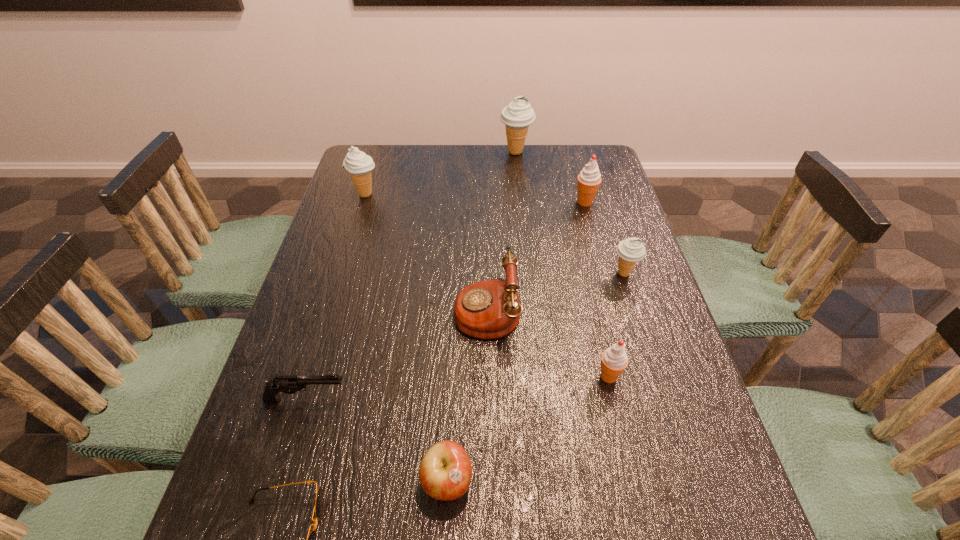
Locate an element on the screen. This screenshot has height=540, width=960. free space that satisfies the following two spatial constraints: 1. at the end of the barrel of the gun; 2. on the back side of the apple is located at coordinates (282, 481).

Identify the location of vacant space that satisfies the following two spatial constraints: 1. on the front side of the nearer red icecream; 2. at the end of the barrel of the third nearest object. Image resolution: width=960 pixels, height=540 pixels. (614, 400).